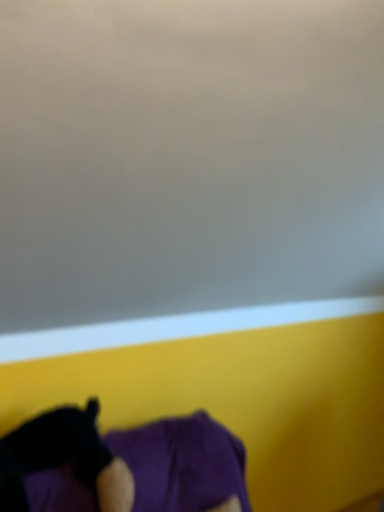
Measure the distance between black fur cat at lower left and camera.

A distance of 4.26 feet exists between black fur cat at lower left and camera.

I want to click on black fur cat at lower left, so click(x=63, y=458).

The height and width of the screenshot is (512, 384). Describe the element at coordinates (63, 458) in the screenshot. I see `black fur cat at lower left` at that location.

Find the location of a particular element. The image size is (384, 512). black fur cat at lower left is located at coordinates (63, 458).